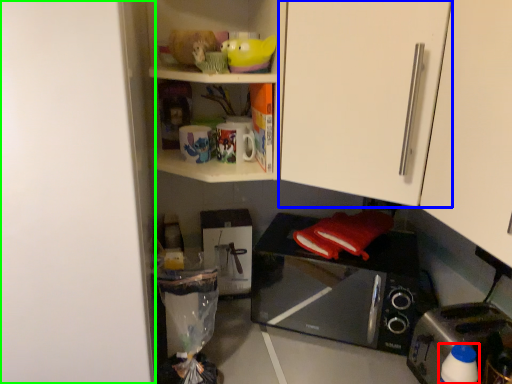
Question: Which object is positioned closest to bottle (highlighted by a red box)? Select from cabinetry (highlighted by a blue box) and door (highlighted by a green box).

Choices:
 (A) cabinetry
 (B) door

Answer: (A)